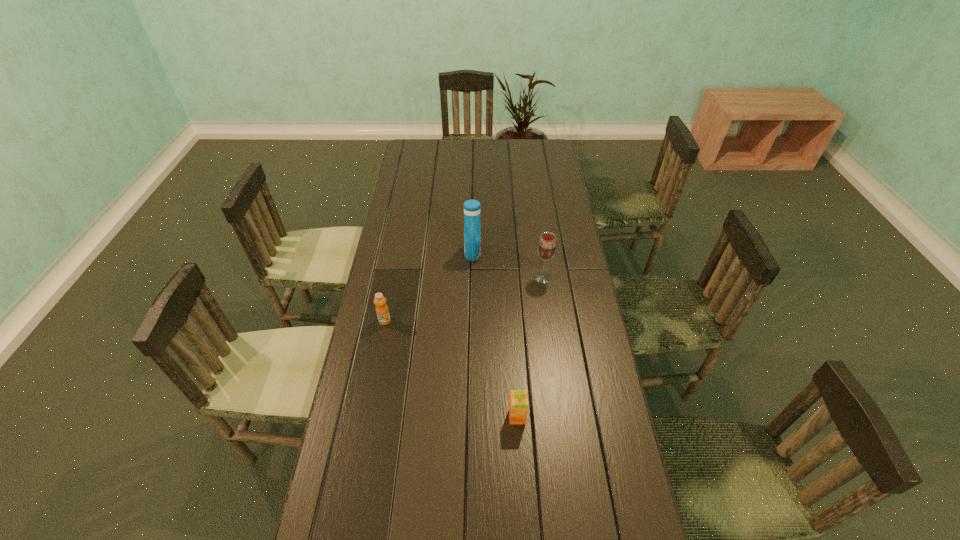
Where is `free space that is in between the leftmost object and the third shortest object`? Image resolution: width=960 pixels, height=540 pixels. free space that is in between the leftmost object and the third shortest object is located at coordinates (464, 299).

I want to click on free space between the nearest object and the third shortest object, so click(x=530, y=347).

You are a GUI agent. You are given a task and a screenshot of the screen. Output one action in this format:
    pyautogui.click(x=<x>, y=<y>)
    Task: Click on the vacant region between the third shortest object and the left orange juice
    The width and height of the screenshot is (960, 540).
    Given the screenshot: What is the action you would take?
    pyautogui.click(x=464, y=299)

I want to click on empty location between the nearer orange juice and the rightmost object, so pos(530,347).

Where is `free area in between the third shortest object and the second object from right to left`? free area in between the third shortest object and the second object from right to left is located at coordinates (530, 347).

Find the location of a particular element. The height and width of the screenshot is (540, 960). empty location between the second object from right to left and the farthest object is located at coordinates (495, 335).

Identify the location of free area in between the rightmost object and the detergent. (508, 266).

Locate which object ranks third in proximity to the nearest object. Please provide its 2D coordinates. Your answer should be formatted as a tuple, i.e. [(x, y)], where the tuple contains the x and y coordinates of a point satisfying the conditions above.

[(472, 230)]

Locate an element on the screen. the third closest object to the left orange juice is located at coordinates (547, 246).

I want to click on free spot that satisfies the following two spatial constraints: 1. on the front-facing side of the third object from right to left; 2. on the front label of the third farthest object, so click(471, 321).